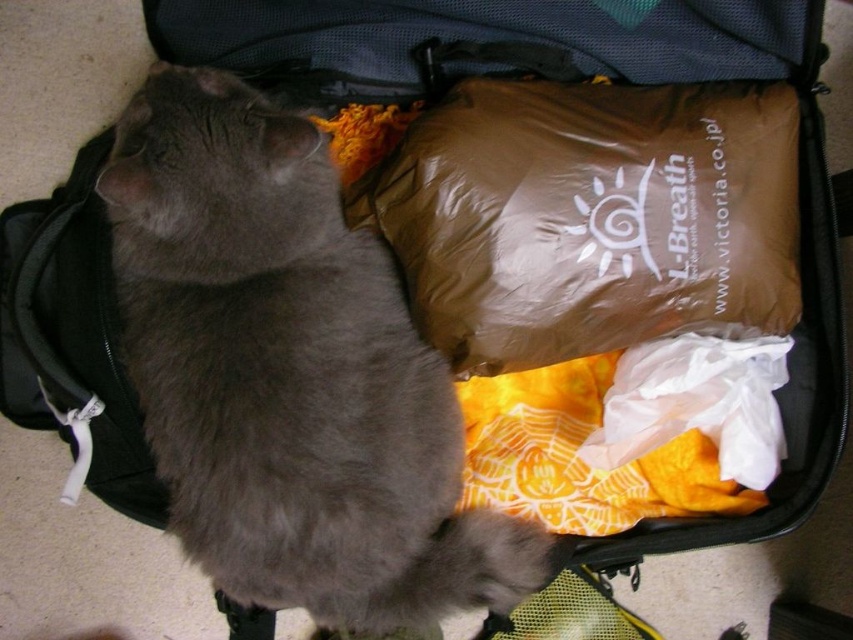
Question: Among these points, which one is nearest to the camera?

Choices:
 (A) (160, 112)
 (B) (728, 186)

Answer: (A)

Question: Which point is closer to the camera?

Choices:
 (A) (575, 356)
 (B) (181, 266)

Answer: (B)

Question: Which of the following is the closest to the observer?

Choices:
 (A) (234, 528)
 (B) (479, 134)

Answer: (A)

Question: Is gray fur cat at center bigger than brown matte sleeping bag at center?

Choices:
 (A) yes
 (B) no

Answer: (A)

Question: Does gray fur cat at center have a smaller size compared to brown matte sleeping bag at center?

Choices:
 (A) no
 (B) yes

Answer: (A)

Question: Where is gray fur cat at center located in relation to brown matte sleeping bag at center in the image?

Choices:
 (A) left
 (B) right

Answer: (A)